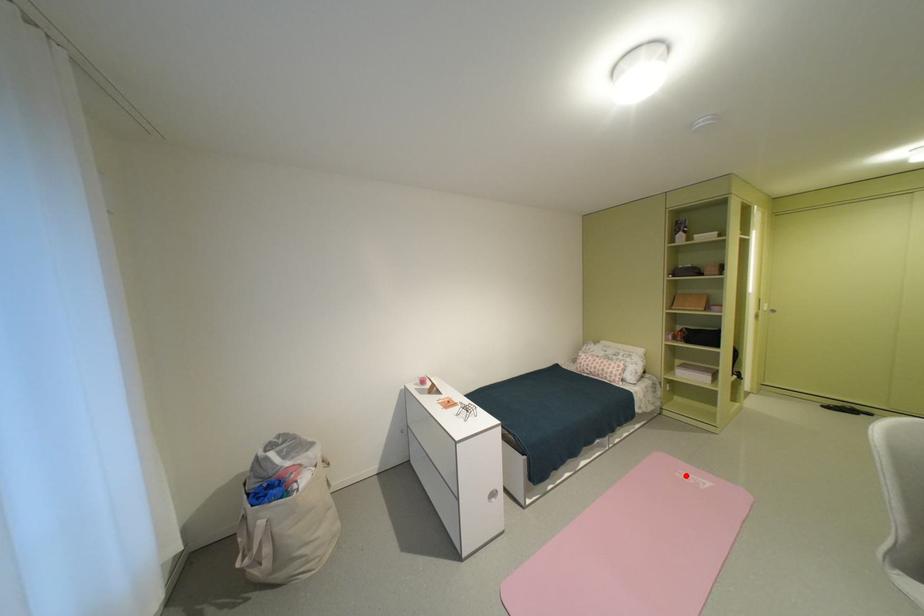
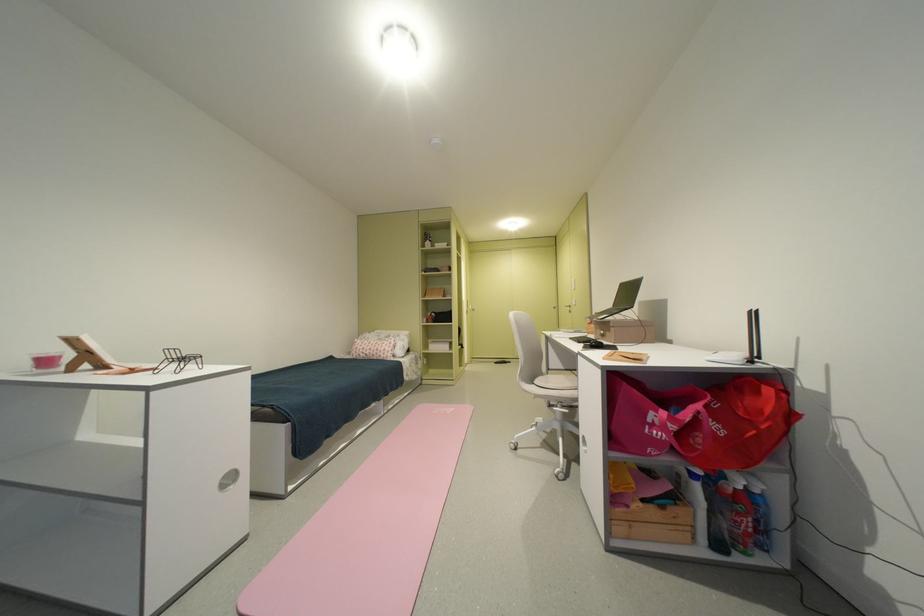
Locate, in the second image, the point that corresponds to the highlighted location in the first image.

(444, 413)